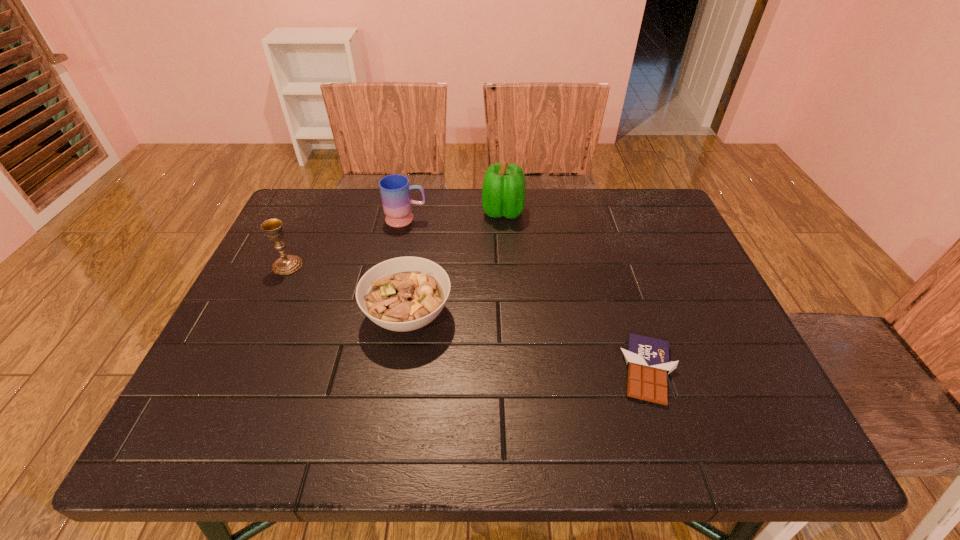
This screenshot has height=540, width=960. What are the coordinates of `object that is the third closest to the fourth object from left to right` in the screenshot? It's located at (647, 358).

This screenshot has height=540, width=960. What are the coordinates of `object that is the third closest to the stew` in the screenshot? It's located at click(503, 193).

In order to click on free space that satisfies the following two spatial constraints: 1. on the side of the mug with the handle; 2. on the right side of the rightmost object in this screenshot , I will do `click(376, 370)`.

Where is `vacant area in the image that satisfies the following two spatial constraints: 1. on the back side of the chalice; 2. on the right side of the tallest object`? Image resolution: width=960 pixels, height=540 pixels. vacant area in the image that satisfies the following two spatial constraints: 1. on the back side of the chalice; 2. on the right side of the tallest object is located at coordinates (312, 212).

The height and width of the screenshot is (540, 960). Identify the location of free region that satisfies the following two spatial constraints: 1. on the back side of the shortest object; 2. on the side of the mug with the handle. (599, 219).

In order to click on vacant area in the image that satisfies the following two spatial constraints: 1. on the back side of the rightmost object; 2. on the side of the mug with the handle in this screenshot , I will do `click(599, 219)`.

Where is `free point that satisfies the following two spatial constraints: 1. on the front side of the stew; 2. on the left side of the rightmost object`? The width and height of the screenshot is (960, 540). free point that satisfies the following two spatial constraints: 1. on the front side of the stew; 2. on the left side of the rightmost object is located at coordinates (399, 370).

The width and height of the screenshot is (960, 540). Find the location of `free space that satisfies the following two spatial constraints: 1. on the side of the mug with the handle; 2. on the left side of the shortest object`. free space that satisfies the following two spatial constraints: 1. on the side of the mug with the handle; 2. on the left side of the shortest object is located at coordinates (376, 370).

Where is `free location that satisfies the following two spatial constraints: 1. on the front side of the chocolate bar; 2. on the left side of the bell pepper`? Image resolution: width=960 pixels, height=540 pixels. free location that satisfies the following two spatial constraints: 1. on the front side of the chocolate bar; 2. on the left side of the bell pepper is located at coordinates (514, 370).